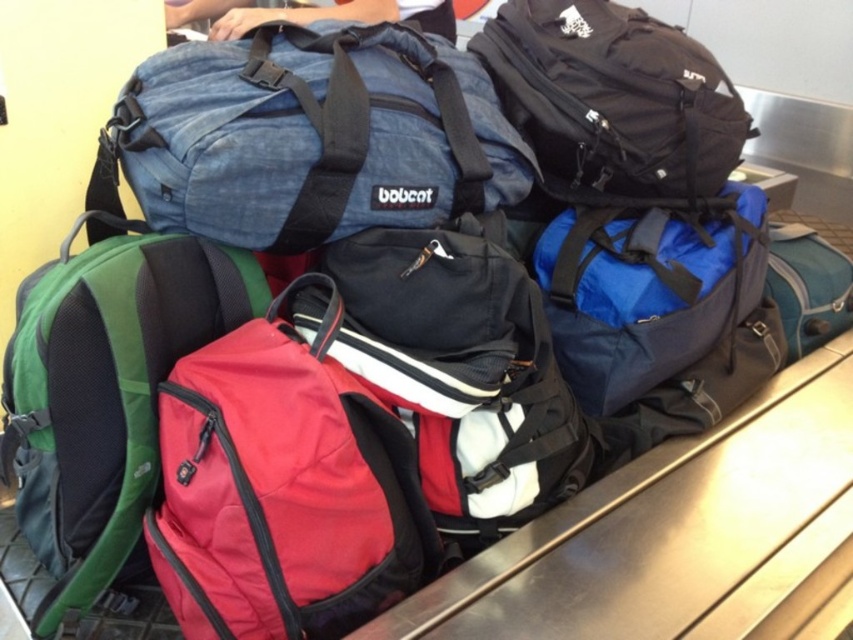
You are a baggage handler at the airport and need to move the black fabric backpack at upper right to the denim fabric duffel at center. How much space do you need to ensure the backpack can be moved without hitting other bags?

The distance between the denim fabric duffel at center and the black fabric backpack at upper right is 12.88 inches, so you need at least 12.88 inches of space to move the backpack without hitting other bags.